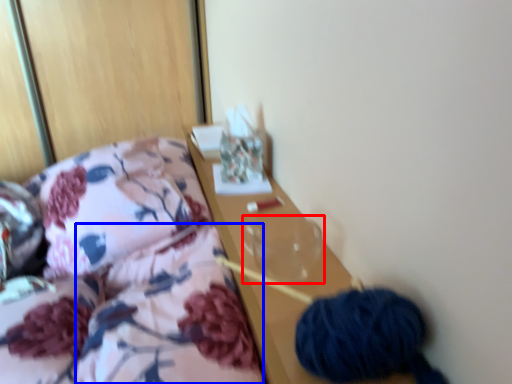
Question: Which object is closer to the camera taking this photo, glass vase (highlighted by a red box) or quilt (highlighted by a blue box)?

Choices:
 (A) glass vase
 (B) quilt

Answer: (B)